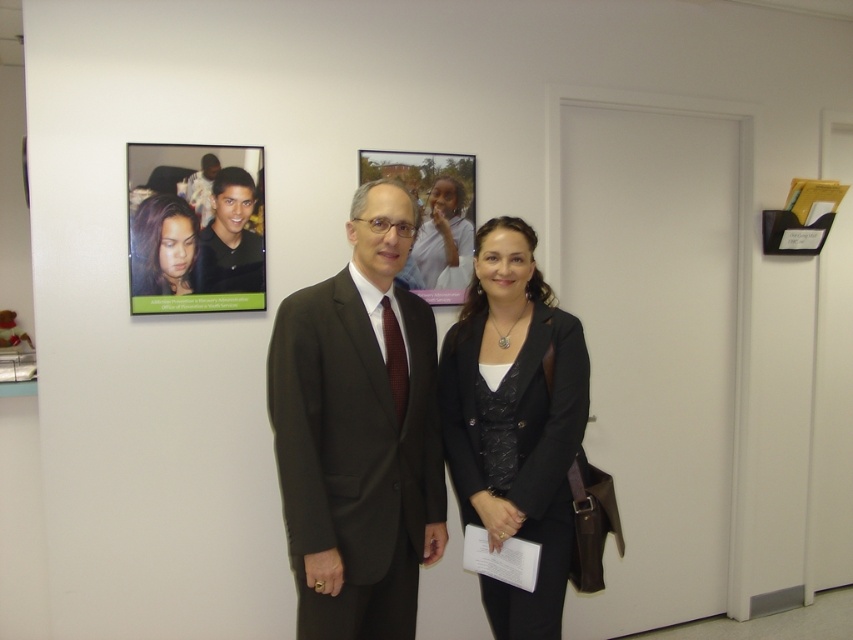
You are an office assistant who needs to hang a new picture between the matte black photo at upper left and the matte black suit at center. Which object should you place the new picture above to maintain alignment?

You should place the new picture above the matte black suit at center because the matte black photo at upper left is already positioned under it.

In the office scene, there are two suits mentioned. The dark gray suit at center and the matte black suit at upper left. Which one is positioned to the right of the other?

The dark gray suit at center is positioned to the right of the matte black suit at upper left.

You are an office assistant and need to deliver a document to the person wearing the matte black suit at center. However, there is another matte black suit at upper left in the scene. Which one is closer to you so that you can avoid confusion?

The matte black suit at upper left is closer to the viewer, so you should look for the matte black suit at center which is further away to avoid confusion.